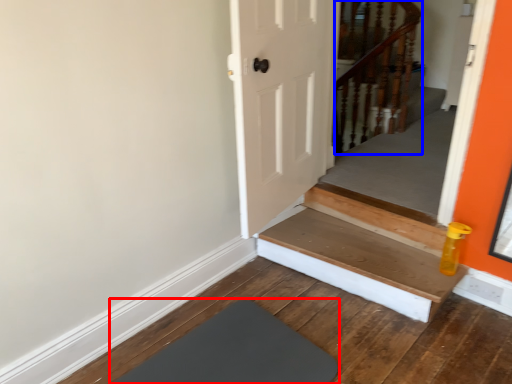
Question: Which of the following is the farthest to the observer, mat (highlighted by a red box) or rail (highlighted by a blue box)?

Choices:
 (A) mat
 (B) rail

Answer: (B)